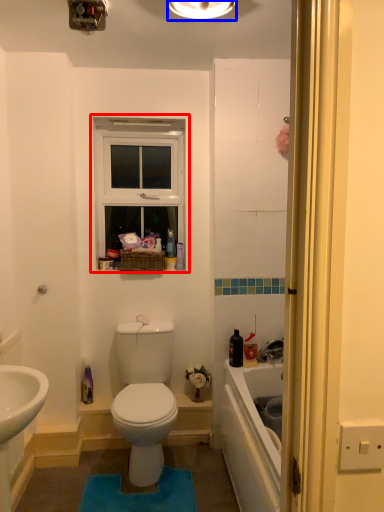
Question: Which object appears farthest to the camera in this image, window (highlighted by a red box) or light fixture (highlighted by a blue box)?

Choices:
 (A) window
 (B) light fixture

Answer: (A)